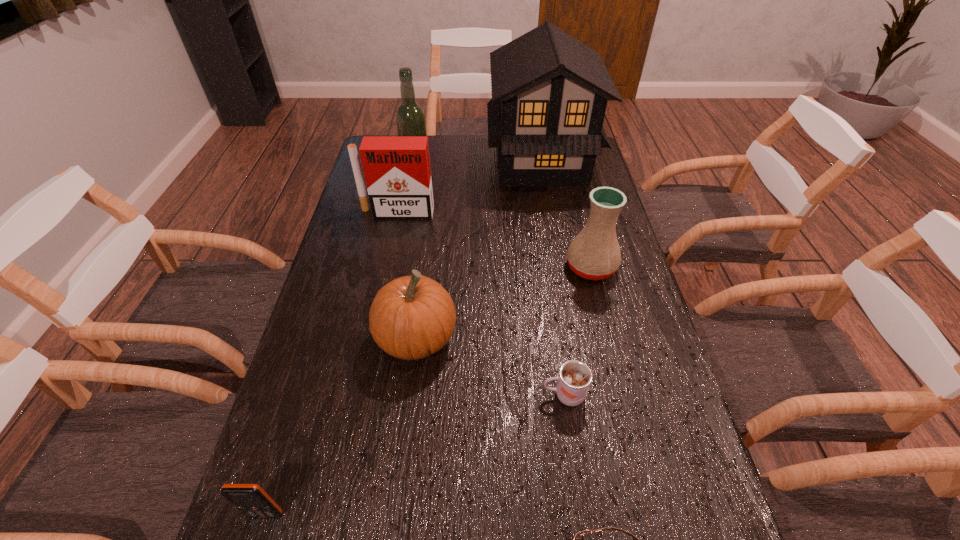
The height and width of the screenshot is (540, 960). Find the location of `free space at the right edge of the desktop`. free space at the right edge of the desktop is located at coordinates (670, 468).

The height and width of the screenshot is (540, 960). In order to click on free space between the pottery and the cup in this screenshot , I will do `click(578, 331)`.

I want to click on free space between the third nearest object and the second tallest object, so click(x=491, y=282).

Find the location of a particular element. This screenshot has width=960, height=540. vacant point located between the seventh shortest object and the pumpkin is located at coordinates (417, 254).

Where is `vacant point located between the pottery and the second nearest object`? The width and height of the screenshot is (960, 540). vacant point located between the pottery and the second nearest object is located at coordinates (429, 391).

Locate an element on the screen. The height and width of the screenshot is (540, 960). empty location between the sixth farthest object and the cigarette case is located at coordinates (481, 303).

At what (x,y) coordinates should I click in order to perform the action: click on free space that is in between the pumpkin and the sixth farthest object. Please return your answer as a coordinate pair (x, y). The height and width of the screenshot is (540, 960). Looking at the image, I should click on (491, 367).

What are the coordinates of `vacant area between the fourth farthest object and the pumpkin` in the screenshot? It's located at (504, 303).

Find the location of a particular element. free spot between the second tallest object and the tallest object is located at coordinates (479, 166).

This screenshot has width=960, height=540. I want to click on object that is the fifth nearest to the fifth farthest object, so click(x=576, y=539).